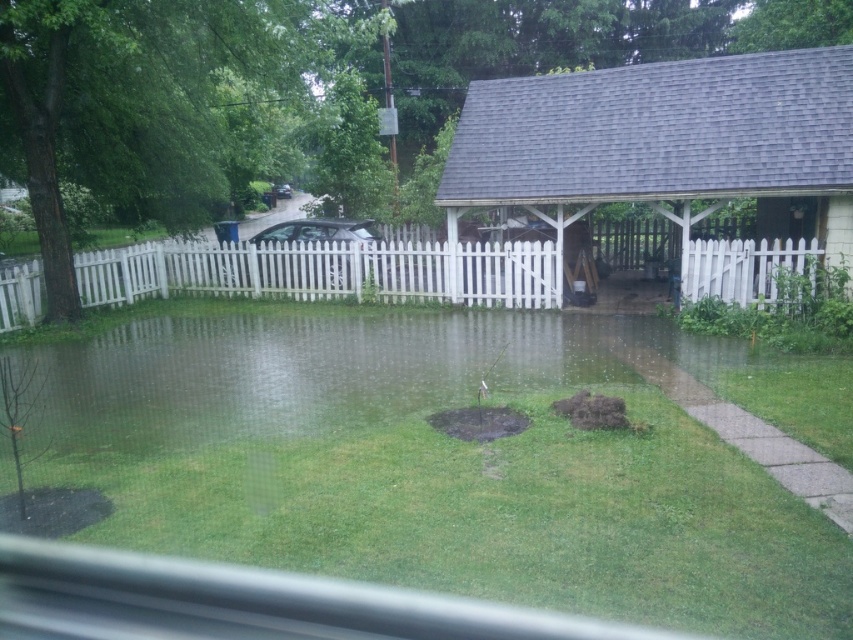
Looking at this image, you are a delivery person with a cart that can carry items up to 30 meters. You need to move items from the gray shingled gazebo at right to the glossy black car at center. Can you complete this task without needing to recharge your cart?

The distance between the gray shingled gazebo at right and the glossy black car at center is 31.00 meters, which exceeds the cart capacity of 30 meters. Therefore, you cannot complete the task without recharging your cart.

You are standing in the backyard on a rainy day. There is a transparent water at center. Where exactly is the transparent water located in relation to the point marked at coordinates (x=479, y=422)?

The transparent water at center is located exactly at the point marked at coordinates (x=479, y=422).

You are planning to install a new garden bench in the backyard. The bench is 1.2 meters wide. You want to place it between the gray shingled gazebo at right and the transparent water at center. Is there enough space between them to fit the bench?

The gray shingled gazebo at right is to the left of transparent water at center, so the distance between them is sufficient to accommodate the 1.2 meter wide bench.